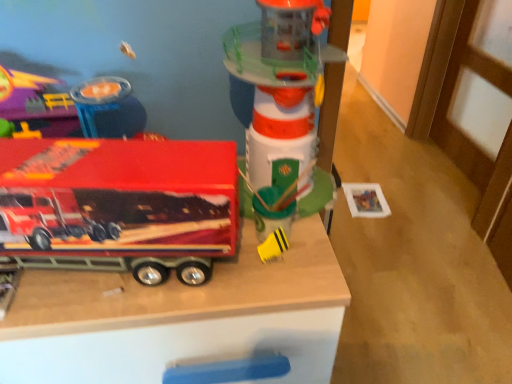
Where is `free space underneath metallic red truck at left, the second toy from the left (from a real-world perspective)`? The height and width of the screenshot is (384, 512). free space underneath metallic red truck at left, the second toy from the left (from a real-world perspective) is located at coordinates (113, 284).